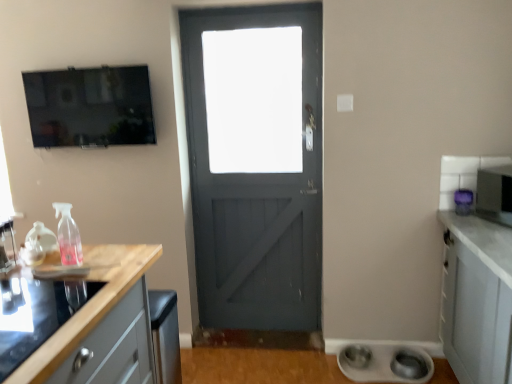
Locate an element on the screen. The height and width of the screenshot is (384, 512). free space to the left of pink translucent spray bottle at left is located at coordinates (16, 271).